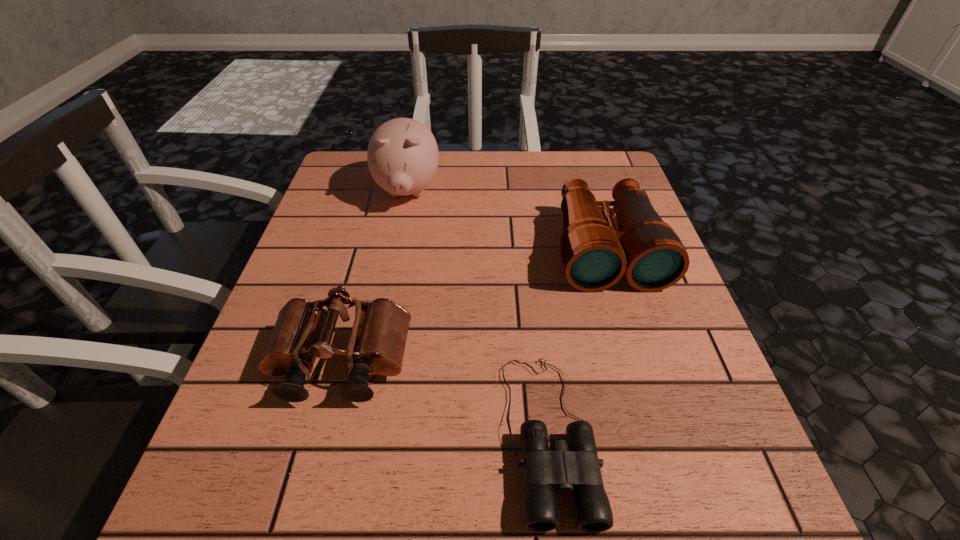
Identify the location of blank region between the tallest object and the shortest object. click(478, 313).

Identify the location of vacant point located between the shortest binoculars and the farthest binoculars. (577, 342).

Identify the location of vacant area that lies between the shortest binoculars and the leftmost binoculars. The height and width of the screenshot is (540, 960). (445, 399).

Where is `vacant space in between the leftmost binoculars and the piggy bank`? This screenshot has width=960, height=540. vacant space in between the leftmost binoculars and the piggy bank is located at coordinates (374, 278).

Locate an element on the screen. This screenshot has width=960, height=540. vacant space in between the shortest binoculars and the farthest binoculars is located at coordinates (577, 342).

Find the location of a particular element. The width and height of the screenshot is (960, 540). vacant area between the farthest binoculars and the leftmost binoculars is located at coordinates (474, 306).

Find the location of a particular element. free space between the tallest object and the shortest binoculars is located at coordinates (478, 313).

At what (x,y) coordinates should I click in order to perform the action: click on free space between the shortest object and the leftmost binoculars. Please return your answer as a coordinate pair (x, y). The height and width of the screenshot is (540, 960). Looking at the image, I should click on (445, 399).

Identify the location of vacant area that lies between the leftmost binoculars and the shortest object. This screenshot has width=960, height=540. (445, 399).

The width and height of the screenshot is (960, 540). Identify the location of empty space between the leftmost binoculars and the farthest binoculars. (474, 306).